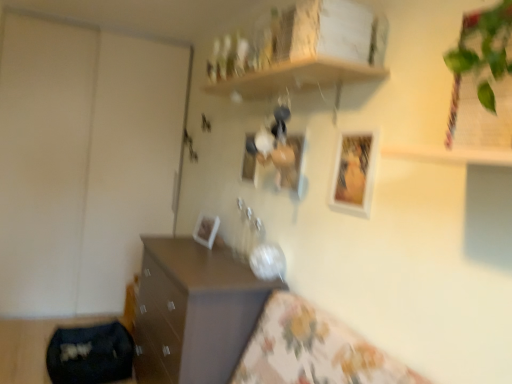
Question: Considering the positions of white glossy picture frame at upper center, acting as the fourth picture frame starting from the back, and wooden shelf at upper center in the image, is white glossy picture frame at upper center, acting as the fourth picture frame starting from the back, wider or thinner than wooden shelf at upper center?

Choices:
 (A) wide
 (B) thin

Answer: (B)

Question: In the image, is white glossy picture frame at upper center, placed as the 1th picture frame when sorted from right to left, on the left side or the right side of wooden shelf at upper center?

Choices:
 (A) right
 (B) left

Answer: (A)

Question: Which is nearer to the green leafy plant at upper right?

Choices:
 (A) matte white picture frame at center, marked as the third picture frame in a front-to-back arrangement
 (B) white glossy picture frame at upper center, placed as the 1th picture frame when sorted from right to left
 (C) wooden shelf at upper center
 (D) matte white picture frame at center, which is the 3th picture frame from back to front
 (E) white plastic picture frame at center, the 1th picture frame positioned from the left

Answer: (B)

Question: Based on their relative distances, which object is nearer to the matte white picture frame at center, the second picture frame from the back?

Choices:
 (A) matte brown chest of drawers at lower left
 (B) wooden shelf at upper center
 (C) green leafy plant at upper right
 (D) white glossy picture frame at upper center, acting as the fourth picture frame starting from the back
 (E) white plastic picture frame at center, which is the 1th picture frame from back to front

Answer: (E)